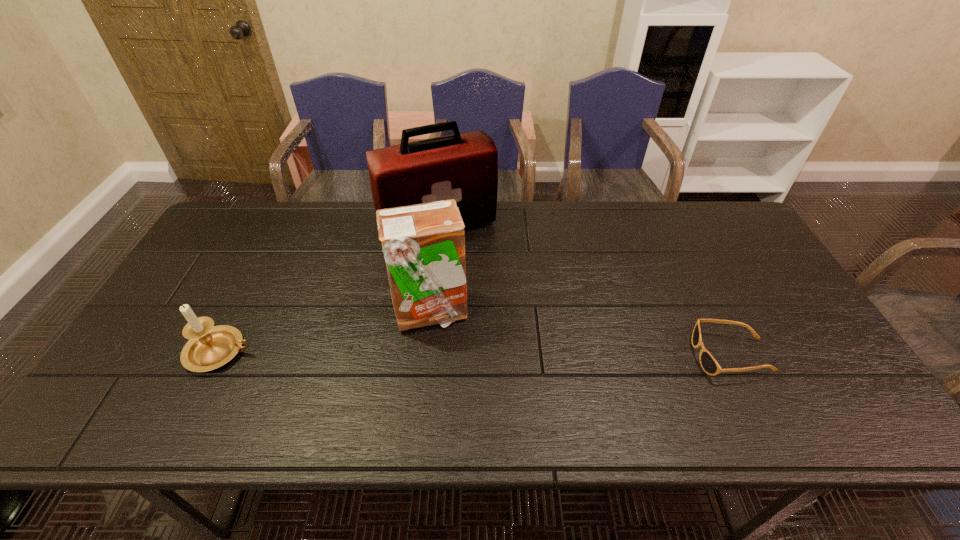
Locate an element on the screen. The width and height of the screenshot is (960, 540). object that is at the right edge is located at coordinates (710, 366).

The height and width of the screenshot is (540, 960). What are the coordinates of `object that is at the near left corner` in the screenshot? It's located at (210, 347).

Where is `object at the near right corner`? object at the near right corner is located at coordinates (710, 366).

This screenshot has width=960, height=540. I want to click on vacant space at the far edge of the desktop, so click(x=557, y=226).

You are a GUI agent. You are given a task and a screenshot of the screen. Output one action in this format:
    pyautogui.click(x=<x>, y=<y>)
    Task: Click on the vacant space at the near edge
    This screenshot has width=960, height=540.
    Given the screenshot: What is the action you would take?
    pyautogui.click(x=621, y=393)

In order to click on free space at the left edge in this screenshot , I will do [x=208, y=249].

In the image, there is a desktop. Where is `blank space at the right edge`? The image size is (960, 540). blank space at the right edge is located at coordinates click(814, 334).

At what (x,y) coordinates should I click in order to perform the action: click on vacant space at the near right corner of the desktop. Please return your answer as a coordinate pair (x, y). The height and width of the screenshot is (540, 960). Looking at the image, I should click on (787, 396).

At what (x,y) coordinates should I click in order to perform the action: click on empty space between the rightmost object and the second shortest object. Please return your answer as a coordinate pair (x, y). The width and height of the screenshot is (960, 540). Looking at the image, I should click on (475, 354).

The width and height of the screenshot is (960, 540). In order to click on vacant region between the shortest object and the carton in this screenshot , I will do `click(581, 334)`.